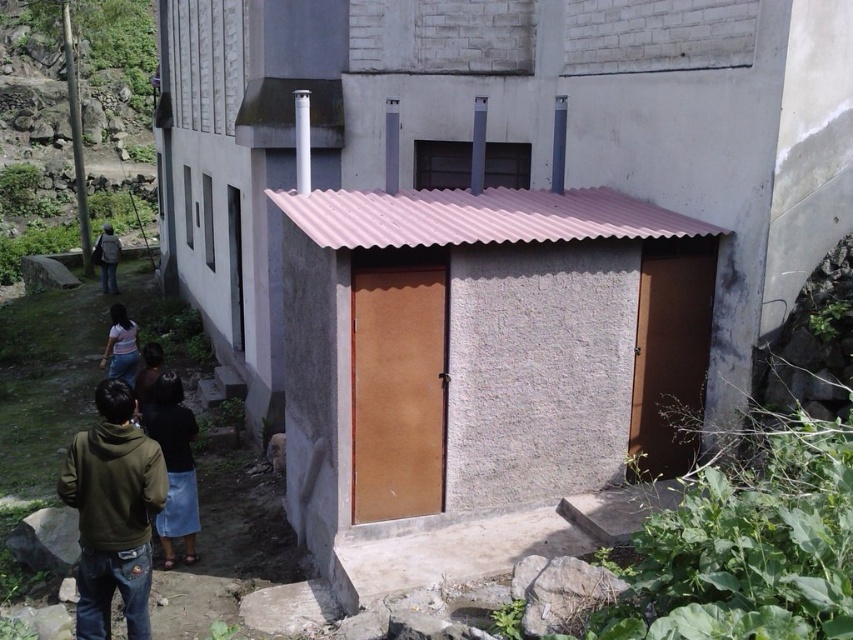
You are standing in front of the utility room and see the dark blue denim skirt at lower center and the dark blue jeans at left. Which item is closer to you?

The dark blue denim skirt at lower center is closer because it is in front of the dark blue jeans at left.

You are standing in front of the utility room and notice a light blue denim skirt at lower left and dark blue jeans at left. If you want to pick up both items, which one should you move towards first based on their positions?

The light blue denim skirt at lower left is closer to you than the dark blue jeans at left, so you should move towards the light blue denim skirt at lower left first.